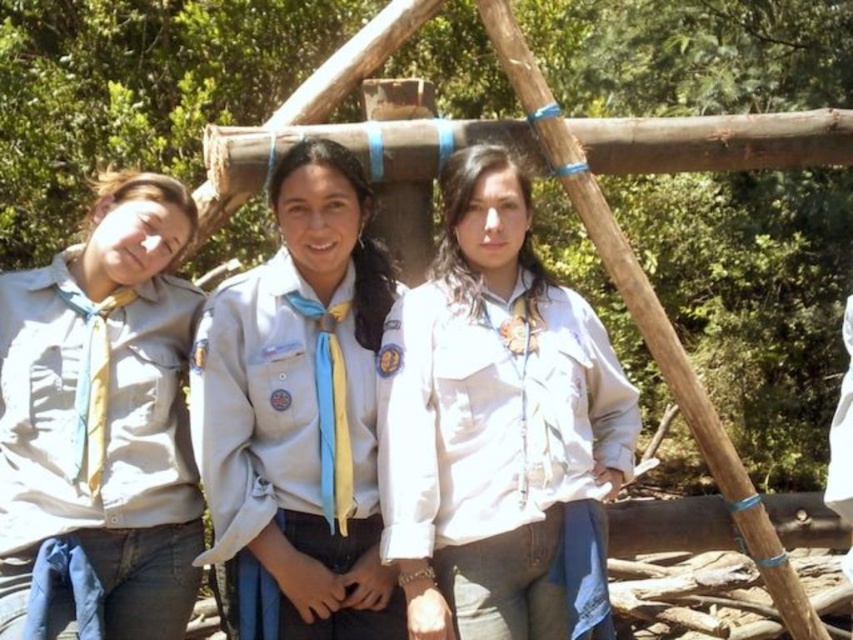
You are a photographer trying to capture a group photo of the scouts. You want to ensure that the white matte shirt at center and the matte khaki shirt at left are both clearly visible in the frame. Based on their positions, which shirt might be partially hidden and why?

The white matte shirt at center might be partially hidden because it is positioned under the matte khaki shirt at left, meaning the khaki shirt could be blocking part of the white one from the camera angle.

You are a photographer trying to capture a group photo of the matte khaki shirt at left and the light blue fabric uniform at center. Since you want to include both in the frame, which side should you position yourself relative to the group to ensure both are fully visible?

The matte khaki shirt at left is positioned on the left side of light blue fabric uniform at center. To include both in the frame, you should position yourself to the right side of the group so that both the left and center individuals are fully visible in the photograph.